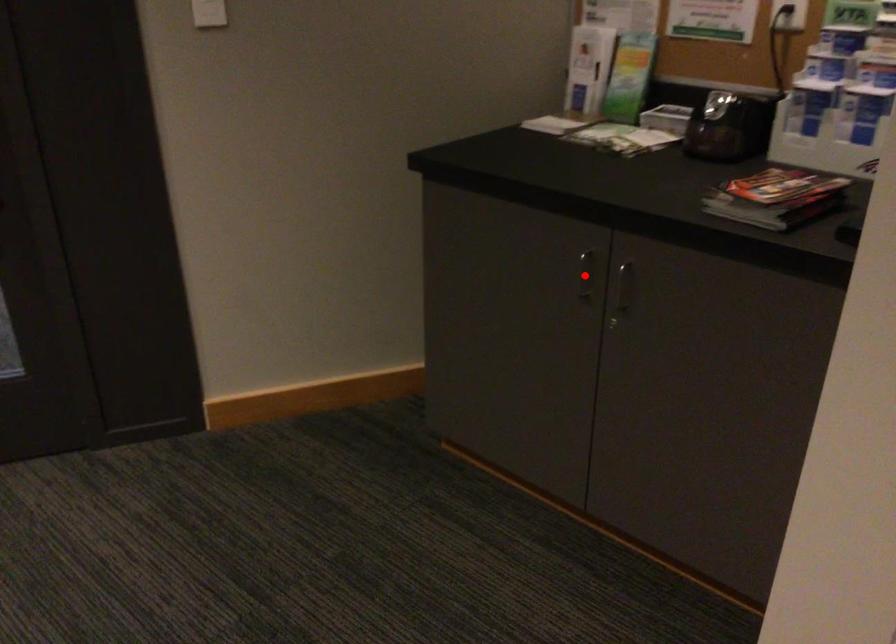
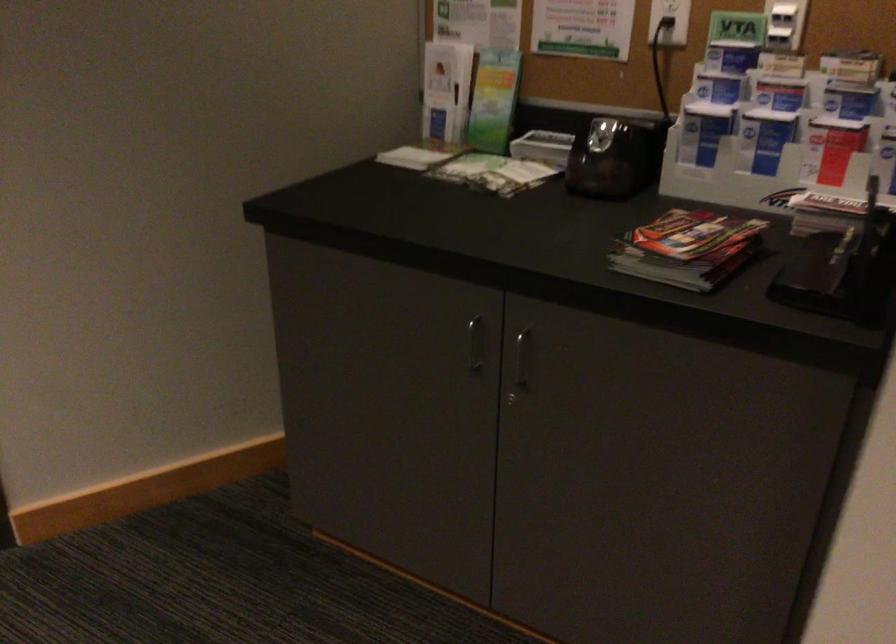
Question: I am providing you with two images of the same scene from different viewpoints. A red point is marked on the first image. Is the red point's position out of view in image 2?

Choices:
 (A) Yes
 (B) No

Answer: (B)